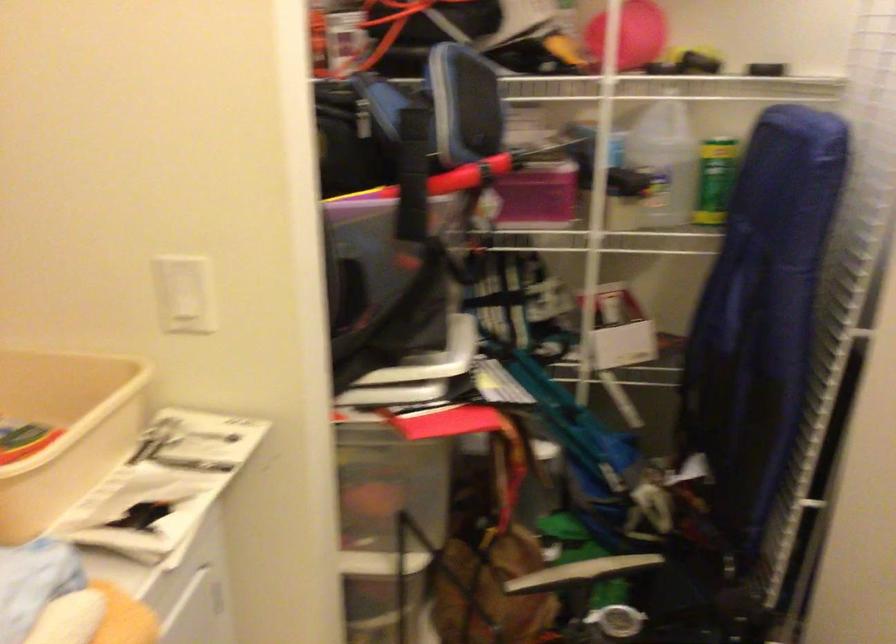
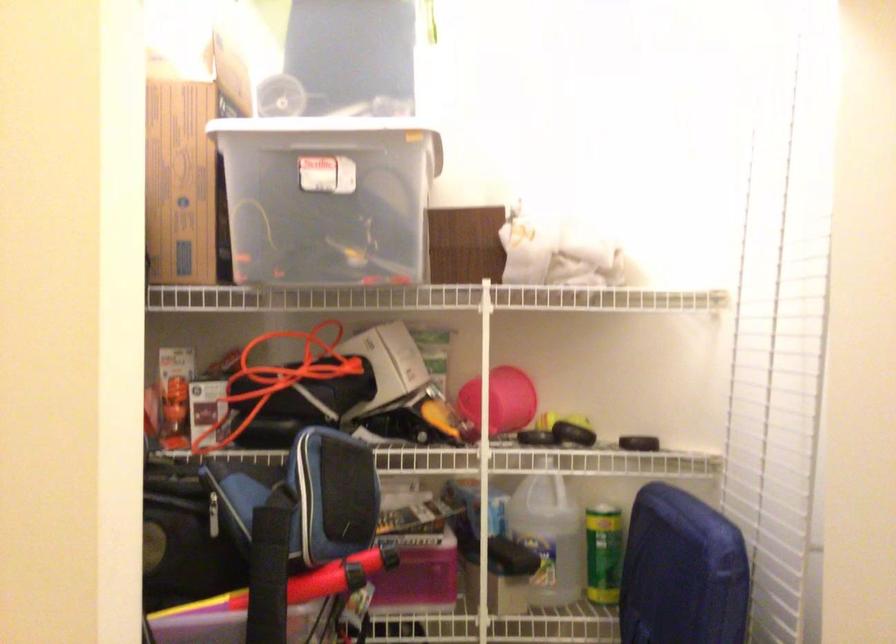
Question: What movement of the cameraman would produce the second image?

Choices:
 (A) Left
 (B) Right
 (C) Forward
 (D) Backward

Answer: (C)